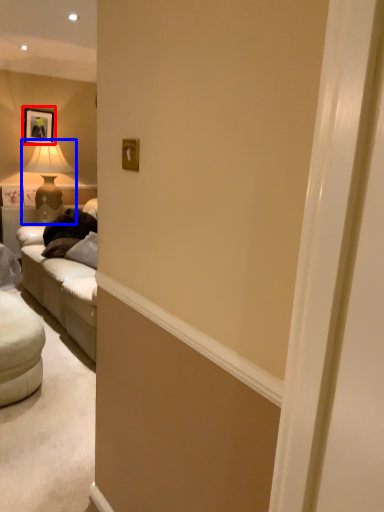
Question: Which of the following is the farthest to the observer, picture frame (highlighted by a red box) or table lamp (highlighted by a blue box)?

Choices:
 (A) picture frame
 (B) table lamp

Answer: (A)